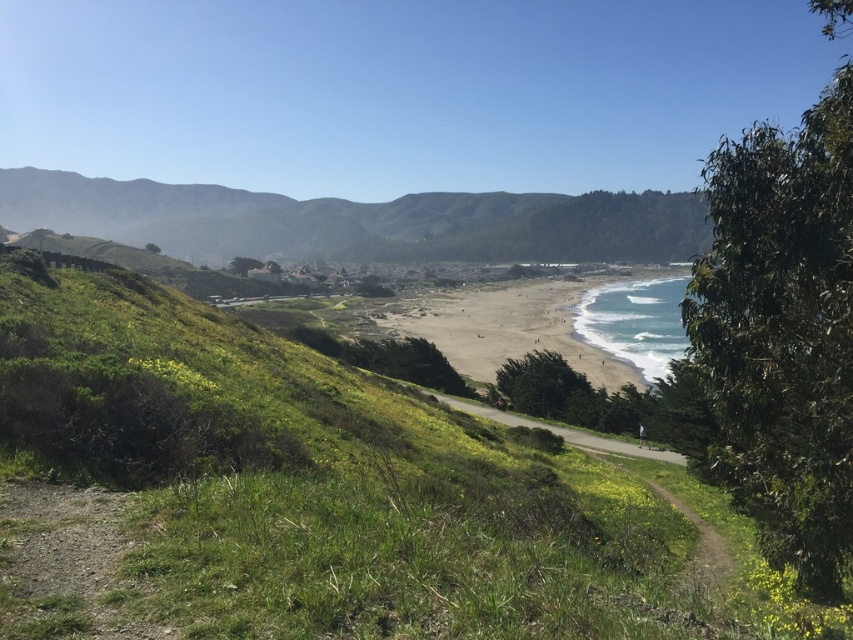
You are planning to set up a picnic area for a group of 20 people. You have two options for locations in the image provided. The first is the green grassy hillside at lower left, and the second is the sandy beach at center. Based on the size of these two areas, which location would be more suitable for accommodating the group comfortably?

The sandy beach at center is more suitable because it is larger than the green grassy hillside at lower left, providing enough space for the group of 20 people.

You are standing on the green grassy hillside at center and want to walk down to the sandy beach at center. Which direction should you move to reach the beach?

Since the green grassy hillside at center is located above the sandy beach at center, you should move downward towards the beach to reach it.